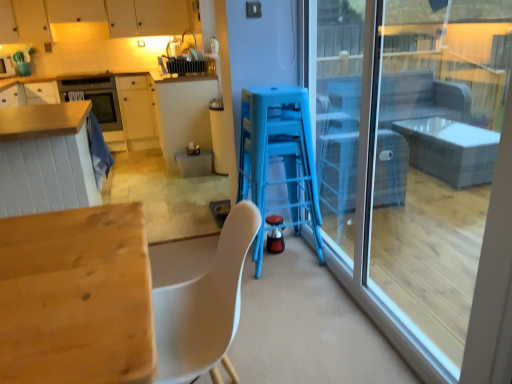
Question: Looking at the image, does blue plastic bar stool at center seem bigger or smaller compared to translucent plastic trash bin at center, acting as the 2th table starting from the bottom?

Choices:
 (A) small
 (B) big

Answer: (A)

Question: Is blue plastic bar stool at center in front of or behind translucent plastic trash bin at center, acting as the 2th table starting from the bottom, in the image?

Choices:
 (A) behind
 (B) front

Answer: (B)

Question: Estimate the real-world distances between objects in this image. Which object is farther from the matte white cabinets at upper left, which ranks as the second cabinetry in bottom-to-top order?

Choices:
 (A) matte white toaster at upper left, the first appliance viewed from the back
 (B) transparent glass door at right
 (C) wooden table at lower left, the 1th table viewed from the front
 (D) shiny black kettle at center, the first appliance in the bottom-to-top sequence
 (E) translucent plastic trash bin at center, the second table from the front

Answer: (C)

Question: Estimate the real-world distances between objects in this image. Which object is farther from the blue plastic bar stool at center?

Choices:
 (A) matte white toaster at upper left, which appears as the 2th appliance when viewed from the front
 (B) transparent glass door at right
 (C) translucent plastic trash bin at center, which is the 1th table from top to bottom
 (D) matte black oven at upper left
 (E) matte wood cabinetry at left, which is the second cabinetry in top-to-bottom order

Answer: (A)